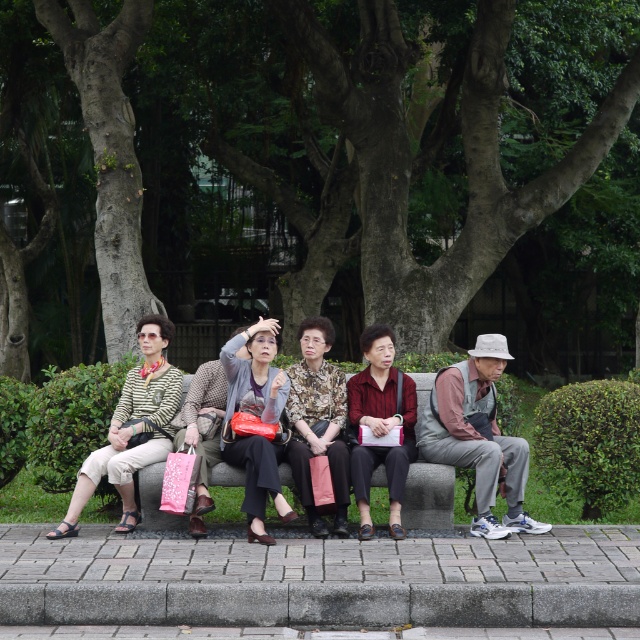
Is green textured tree at center positioned before maroon fabric jacket at center?

That is False.

You are a GUI agent. You are given a task and a screenshot of the screen. Output one action in this format:
    pyautogui.click(x=<x>, y=<y>)
    Task: Click on the green textured tree at center
    This screenshot has width=640, height=640.
    Given the screenshot: What is the action you would take?
    pyautogui.click(x=317, y=166)

Which is below, striped fabric sweater at left or patterned fabric blouse at center?

striped fabric sweater at left

Is striped fabric sweater at left further to camera compared to patterned fabric blouse at center?

No, it is in front of patterned fabric blouse at center.

You are a GUI agent. You are given a task and a screenshot of the screen. Output one action in this format:
    pyautogui.click(x=<x>, y=<y>)
    Task: Click on the striped fabric sweater at left
    
    Given the screenshot: What is the action you would take?
    point(131,428)

Where is `striped fabric sweater at left`? The image size is (640, 640). striped fabric sweater at left is located at coordinates (131, 428).

Based on the photo, who is positioned more to the left, smooth gray bark at left or patterned fabric blouse at center?

smooth gray bark at left is more to the left.

This screenshot has height=640, width=640. What are the coordinates of `smooth gray bark at left` in the screenshot? It's located at (109, 154).

You are a GUI agent. You are given a task and a screenshot of the screen. Output one action in this format:
    pyautogui.click(x=<x>, y=<y>)
    Task: Click on the smooth gray bark at left
    
    Given the screenshot: What is the action you would take?
    pyautogui.click(x=109, y=154)

Find the location of a particular element. This screenshot has width=640, height=640. smooth gray bark at left is located at coordinates (109, 154).